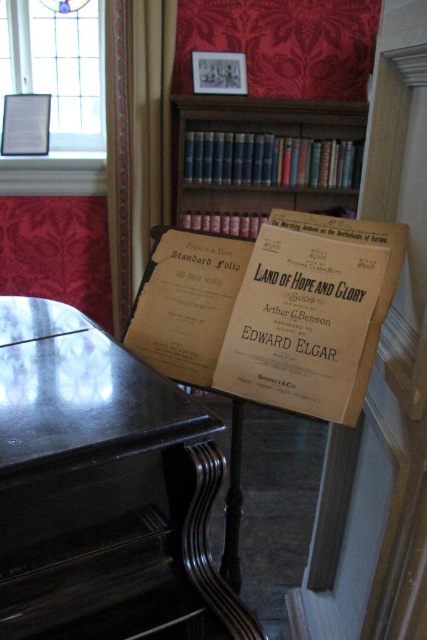
Question: Does black polished piano at center have a larger size compared to wooden bookcase at upper center?

Choices:
 (A) no
 (B) yes

Answer: (B)

Question: Which of the following is the closest to the observer?

Choices:
 (A) (196, 161)
 (B) (140, 500)

Answer: (B)

Question: Which point is closer to the camera?

Choices:
 (A) (339, 112)
 (B) (64, 420)

Answer: (B)

Question: Which of the following is the farthest from the observer?

Choices:
 (A) (177, 616)
 (B) (213, 163)

Answer: (B)

Question: Is black polished piano at center bigger than wooden bookcase at upper center?

Choices:
 (A) no
 (B) yes

Answer: (B)

Question: Can you confirm if black polished piano at center is positioned to the left of wooden bookcase at upper center?

Choices:
 (A) yes
 (B) no

Answer: (A)